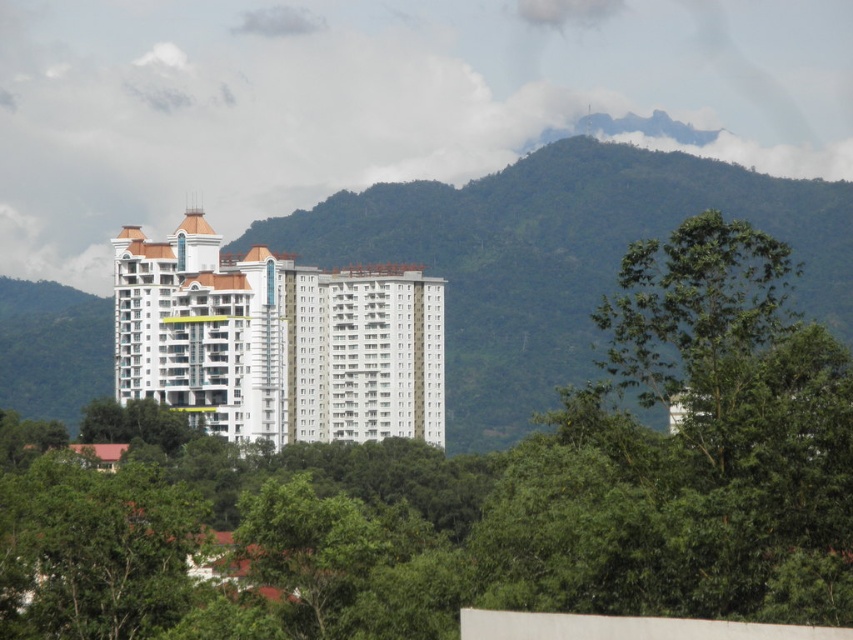
Question: Estimate the real-world distances between objects in this image. Which object is farther from the green leafy tree at center?

Choices:
 (A) green leafy mountain at upper center
 (B) green leafy tree at center-right

Answer: (A)

Question: Which point is closer to the camera taking this photo?

Choices:
 (A) (643, 342)
 (B) (355, 625)

Answer: (B)

Question: Can you confirm if green leafy tree at center is thinner than green leafy mountain at upper center?

Choices:
 (A) yes
 (B) no

Answer: (A)

Question: Can you confirm if green leafy tree at center is positioned above green leafy mountain at upper center?

Choices:
 (A) no
 (B) yes

Answer: (A)

Question: Can you confirm if green leafy tree at center is positioned above green leafy mountain at upper center?

Choices:
 (A) yes
 (B) no

Answer: (B)

Question: Among these points, which one is farthest from the camera?

Choices:
 (A) (492, 524)
 (B) (549, 317)
 (C) (648, 346)

Answer: (B)